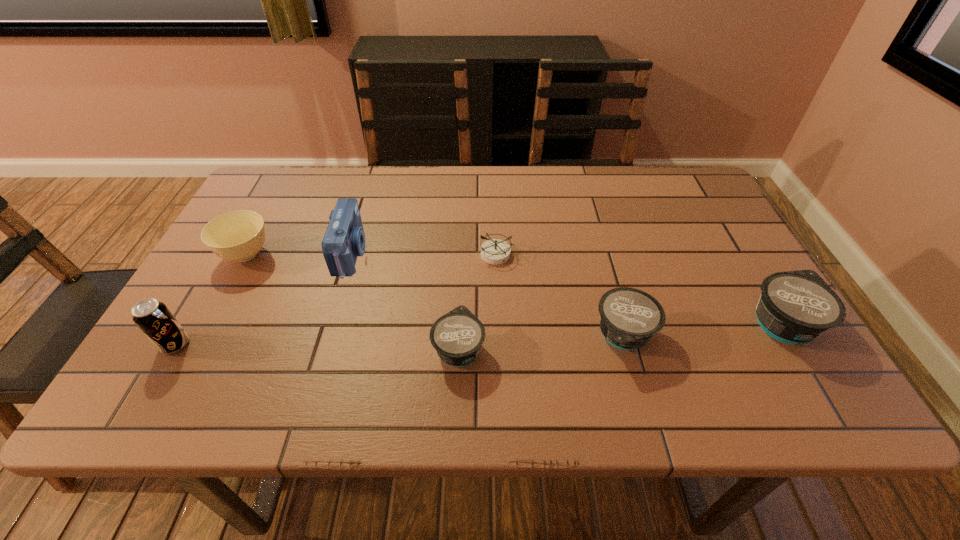
Given the evenly spaced yogurts in the image, where should an extra yogurt be added on the left to preserve the spacing? Please point to a vacant space. Please provide its 2D coordinates. Your answer should be formatted as a tuple, i.e. [(x, y)], where the tuple contains the x and y coordinates of a point satisfying the conditions above.

[(285, 361)]